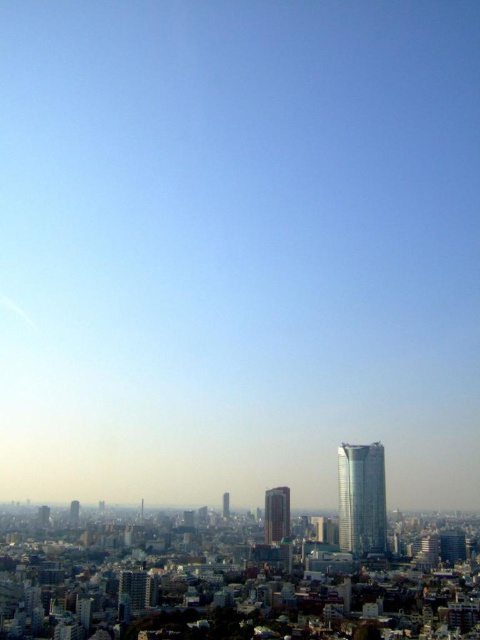
Question: Which point is closer to the camera taking this photo?

Choices:
 (A) (361, 458)
 (B) (227, 516)
 (C) (73, 522)

Answer: (A)

Question: Among these objects, which one is farthest from the camera?

Choices:
 (A) smooth glass skyscraper at center
 (B) matte gray skyscraper at lower left

Answer: (B)

Question: Is matte gray building at lower left smaller than smooth gold tower at center?

Choices:
 (A) no
 (B) yes

Answer: (A)

Question: Does silver metallic tower at right have a smaller size compared to matte gray building at lower left?

Choices:
 (A) yes
 (B) no

Answer: (B)

Question: Does silver metallic tower at right have a larger size compared to smooth glass skyscraper at center?

Choices:
 (A) no
 (B) yes

Answer: (B)

Question: Which object is positioned farthest from the silver metallic tower at right?

Choices:
 (A) smooth glass skyscraper at center
 (B) matte gray skyscraper at lower left
 (C) smooth gold tower at center

Answer: (B)